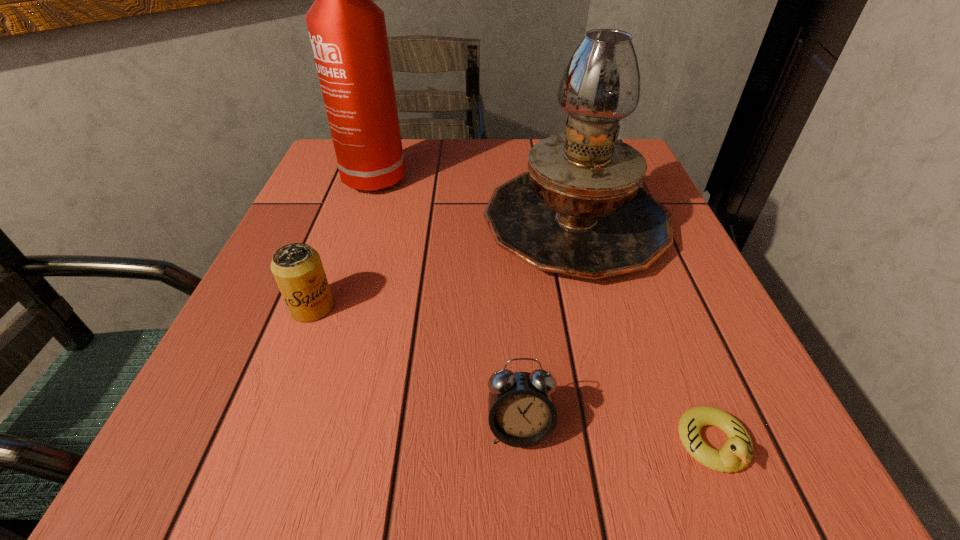
I want to click on empty space that is in between the second tallest object and the shortest object, so click(643, 333).

Where is `free space between the alarm clock and the shortest object`? The image size is (960, 540). free space between the alarm clock and the shortest object is located at coordinates pyautogui.click(x=616, y=436).

At what (x,y) coordinates should I click in order to perform the action: click on vacant area that lies between the tallest object and the third nearest object. Please return your answer as a coordinate pair (x, y). Image resolution: width=960 pixels, height=540 pixels. Looking at the image, I should click on (344, 240).

Image resolution: width=960 pixels, height=540 pixels. Find the location of `object that stands as the fourth closest to the fire extinguisher`. object that stands as the fourth closest to the fire extinguisher is located at coordinates (737, 452).

I want to click on the second closest object to the shortest object, so (580, 210).

What are the coordinates of `vacant space that satisfies the following two spatial constraints: 1. at the nozzle of the oil lamp; 2. on the right side of the fire extinguisher` in the screenshot? It's located at (360, 222).